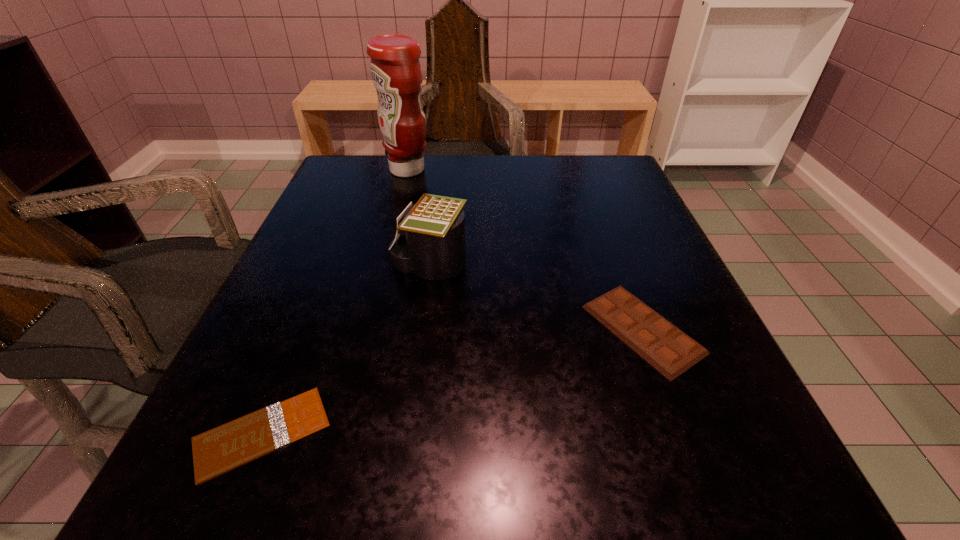
You are a GUI agent. You are given a task and a screenshot of the screen. Output one action in this format:
    pyautogui.click(x=<x>, y=<y>)
    Task: Click on the free space between the calculator and the left chocolate bar
    This screenshot has width=960, height=540.
    Given the screenshot: What is the action you would take?
    pyautogui.click(x=346, y=348)

You are a GUI agent. You are given a task and a screenshot of the screen. Output one action in this format:
    pyautogui.click(x=<x>, y=<y>)
    Task: Click on the free point between the third shortest object and the left chocolate bar
    
    Given the screenshot: What is the action you would take?
    pyautogui.click(x=346, y=348)

Image resolution: width=960 pixels, height=540 pixels. In order to click on empty space that is in between the right chocolate bar and the nearest object in this screenshot , I will do `click(452, 381)`.

You are a GUI agent. You are given a task and a screenshot of the screen. Output one action in this format:
    pyautogui.click(x=<x>, y=<y>)
    Task: Click on the free space between the calculator and the shortest object
    
    Given the screenshot: What is the action you would take?
    click(x=346, y=348)

Identify the location of free space that is in between the tallest object and the taller chocolate bar. This screenshot has height=540, width=960. (525, 249).

Identify the location of object that is the second closest to the tallest object. This screenshot has height=540, width=960. (669, 350).

Identify which object is located as the nearest to the calculator. Please provide its 2D coordinates. Your answer should be formatted as a tuple, i.e. [(x, y)], where the tuple contains the x and y coordinates of a point satisfying the conditions above.

[(669, 350)]

Find the location of a particular element. free spot that satisfies the following two spatial constraints: 1. on the front side of the rightmost object; 2. on the right side of the calculator is located at coordinates (420, 329).

Find the location of a particular element. Image resolution: width=960 pixels, height=540 pixels. vacant area in the image that satisfies the following two spatial constraints: 1. on the back side of the left chocolate bar; 2. on the left side of the third shortest object is located at coordinates (330, 264).

Where is `blank area in the image that satisfies the following two spatial constraints: 1. on the back side of the calculator; 2. on the right side of the shorter chocolate bar`? This screenshot has height=540, width=960. blank area in the image that satisfies the following two spatial constraints: 1. on the back side of the calculator; 2. on the right side of the shorter chocolate bar is located at coordinates (330, 264).